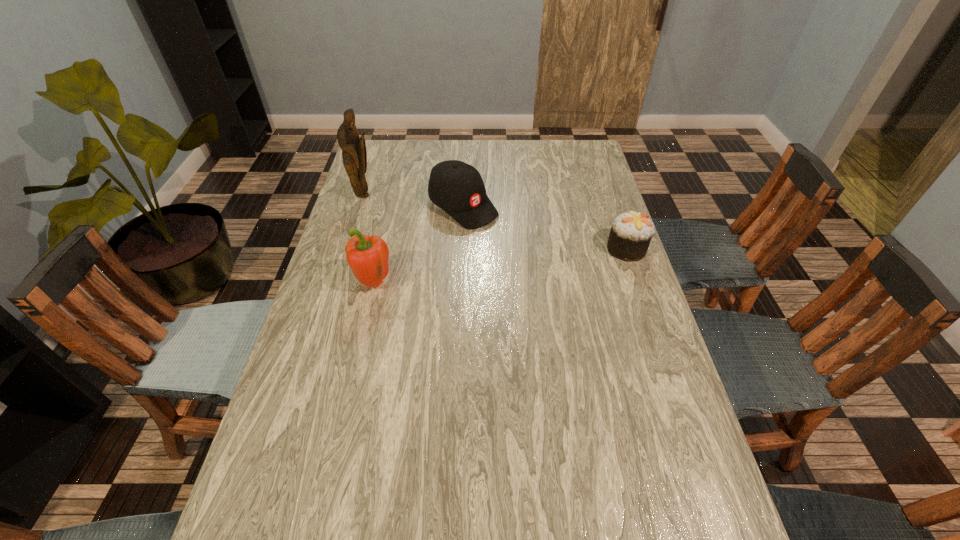
Locate an element on the screen. Image resolution: width=960 pixels, height=540 pixels. vacant spot on the desktop that is between the nearest object and the rightmost object and is positioned on the front-facing side of the leftmost object is located at coordinates (507, 266).

Find the location of a particular element. vacant space on the desktop that is between the third object from right to left and the rightmost object and is positioned with a logo on the front of the third object from left to right is located at coordinates (536, 261).